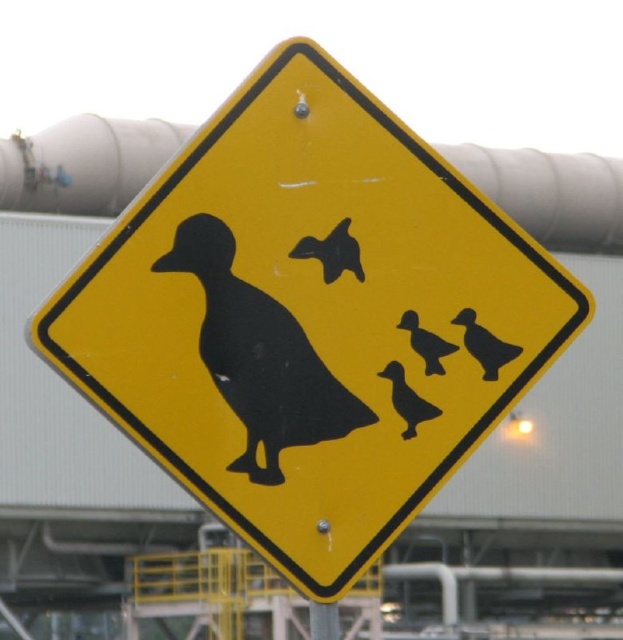
Question: Which point appears closest to the camera in this image?

Choices:
 (A) (207, 300)
 (B) (444, 353)

Answer: (A)

Question: Does matte black duckling at lower right appear under black matte duck at lower right?

Choices:
 (A) yes
 (B) no

Answer: (B)

Question: Is black matte duck at center to the left of matte black duckling at lower right from the viewer's perspective?

Choices:
 (A) no
 (B) yes

Answer: (B)

Question: Among these objects, which one is nearest to the camera?

Choices:
 (A) black matte duckling at center
 (B) matte black duckling at lower right
 (C) black matte duck at center

Answer: (C)

Question: Does black matte duck at lower right appear under black matte duckling at center?

Choices:
 (A) no
 (B) yes

Answer: (B)

Question: Which is nearer to the black matte duck at center?

Choices:
 (A) black matte duckling at center
 (B) matte black duckling at lower right
 (C) black matte duck at lower right

Answer: (C)